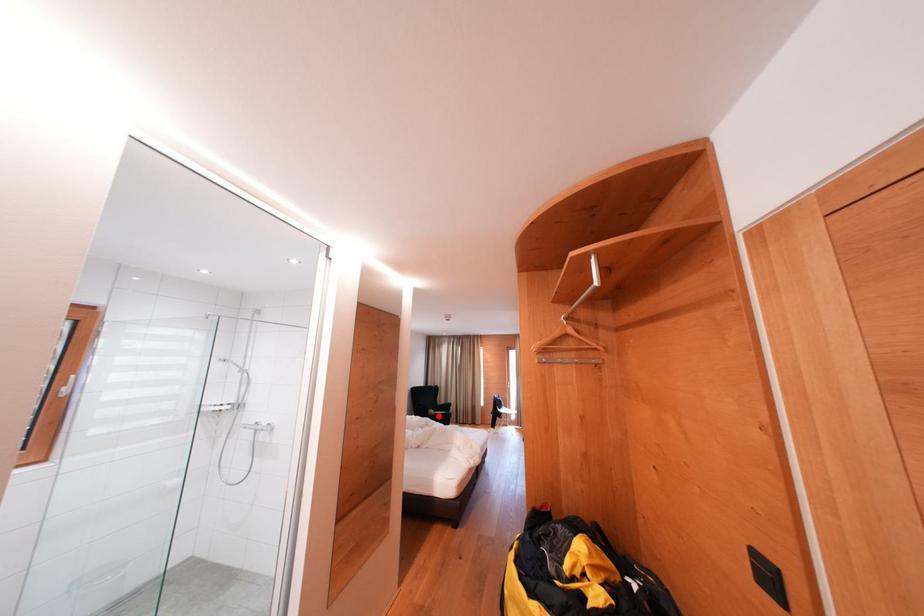
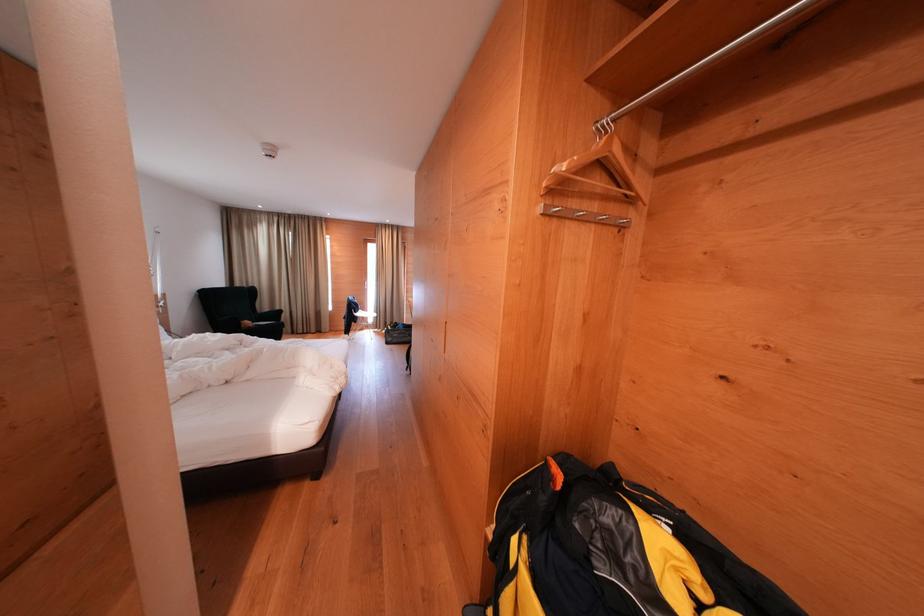
Question: I am providing you with two images of the same scene from different viewpoints. A red point is shown in image1. For the corresponding object point in image2, is it positioned nearer or farther from the camera?

Choices:
 (A) Nearer
 (B) Farther

Answer: (A)